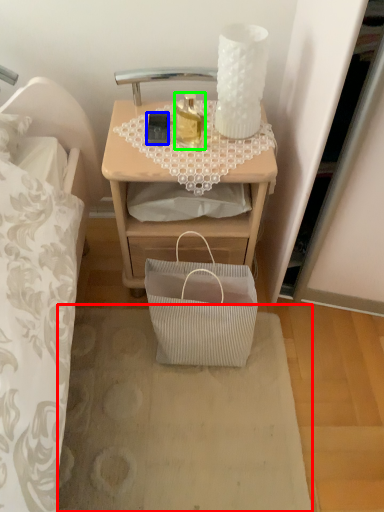
Question: Estimate the real-world distances between objects in this image. Which object is closer to plain (highlighted by a red box), mobile phone (highlighted by a blue box) or bottle (highlighted by a green box)?

Choices:
 (A) mobile phone
 (B) bottle

Answer: (B)